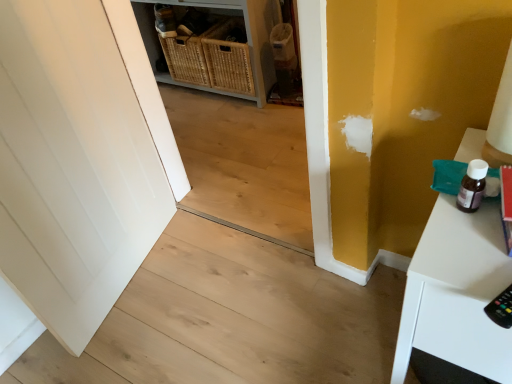
What is the approximate height of natural wood stair at center?

It is 2.40 inches.

Where is `woven wicker baskets at center`? The width and height of the screenshot is (512, 384). woven wicker baskets at center is located at coordinates (246, 33).

How different are the orientations of white glossy table at right and woven wicker baskets at center in degrees?

white glossy table at right and woven wicker baskets at center are facing 1.77 degrees away from each other.

Is point (419, 246) behind point (260, 49)?

No, it is not.

From the image's perspective, does white glossy table at right appear higher than woven wicker baskets at center?

No, from the image's perspective, white glossy table at right is not on top of woven wicker baskets at center.

The width and height of the screenshot is (512, 384). What are the coordinates of `shelf on the left of the white glossy table at right` in the screenshot? It's located at (246, 33).

Can you confirm if woven wicker baskets at center is wider than natural wood stair at center?

In fact, woven wicker baskets at center might be narrower than natural wood stair at center.

Consider the image. Could you tell me if woven wicker baskets at center is facing natural wood stair at center?

No, woven wicker baskets at center is not oriented towards natural wood stair at center.

Would you say woven wicker baskets at center is to the left or to the right of natural wood stair at center in the picture?

From the image, it's evident that woven wicker baskets at center is to the left of natural wood stair at center.

Is natural wood stair at center next to woven wicker baskets at center and touching it?

natural wood stair at center is not next to woven wicker baskets at center, and they're not touching.

Is woven wicker baskets at center at the back of natural wood stair at center?

That's not correct — natural wood stair at center is not looking away from woven wicker baskets at center.

This screenshot has width=512, height=384. I want to click on stair directly beneath the woven wicker baskets at center (from a real-world perspective), so click(231, 319).

Considering the sizes of objects woven wicker baskets at center and white glossy table at right in the image provided, who is shorter, woven wicker baskets at center or white glossy table at right?

With less height is woven wicker baskets at center.

Is the position of woven wicker baskets at center less distant than that of white glossy table at right?

No, woven wicker baskets at center is further to the viewer.

Does point (245, 12) lie behind point (465, 359)?

Yes, it is.

From the image's perspective, which one is positioned higher, woven wicker baskets at center or white glossy table at right?

woven wicker baskets at center appears higher in the image.

Is white glossy table at right at the back of natural wood stair at center?

No, white glossy table at right is not at the back of natural wood stair at center.

Which of these two, natural wood stair at center or white glossy table at right, is wider?

Wider between the two is natural wood stair at center.

Which object is further away from the camera, natural wood stair at center or white glossy table at right?

Positioned behind is natural wood stair at center.

Considering the positions of objects natural wood stair at center and white glossy table at right in the image provided, who is more to the right, natural wood stair at center or white glossy table at right?

white glossy table at right is more to the right.

From the image's perspective, which is below, white glossy table at right or natural wood stair at center?

natural wood stair at center, from the image's perspective.

From a real-world perspective, is white glossy table at right below natural wood stair at center?

Incorrect, from a real-world perspective, white glossy table at right is higher than natural wood stair at center.

Is white glossy table at right not close to natural wood stair at center?

That's not correct — white glossy table at right is a little close to natural wood stair at center.

At what (x,y) coordinates should I click in order to perform the action: click on shelf on the left of white glossy table at right. Please return your answer as a coordinate pair (x, y). This screenshot has width=512, height=384. Looking at the image, I should click on (246, 33).

What are the coordinates of `stair lying on the right of woven wicker baskets at center` in the screenshot? It's located at (231, 319).

Estimate the real-world distances between objects in this image. Which object is closer to white glossy table at right, woven wicker baskets at center or natural wood stair at center?

natural wood stair at center is closer to white glossy table at right.

Considering their positions, is woven wicker baskets at center positioned closer to natural wood stair at center than white glossy table at right?

white glossy table at right is positioned closer to the anchor natural wood stair at center.

From the image, which object appears to be nearer to woven wicker baskets at center, natural wood stair at center or white glossy table at right?

natural wood stair at center is positioned closer to the anchor woven wicker baskets at center.

From the image, which object appears to be farther from white glossy table at right, natural wood stair at center or woven wicker baskets at center?

Based on the image, woven wicker baskets at center appears to be further to white glossy table at right.

Looking at the image, which one is located further to natural wood stair at center, white glossy table at right or woven wicker baskets at center?

Among the two, woven wicker baskets at center is located further to natural wood stair at center.

Considering their positions, is white glossy table at right positioned closer to woven wicker baskets at center than natural wood stair at center?

natural wood stair at center is closer to woven wicker baskets at center.

At what (x,y) coordinates should I click in order to perform the action: click on stair positioned between white glossy table at right and woven wicker baskets at center from near to far. Please return your answer as a coordinate pair (x, y). Looking at the image, I should click on (231, 319).